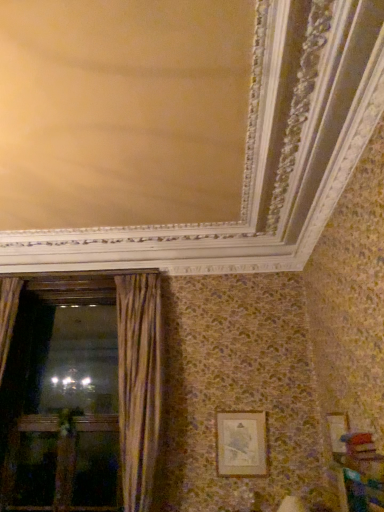
Question: Is gold textured curtain at left at the right side of wooden cabinet at lower right?

Choices:
 (A) no
 (B) yes

Answer: (A)

Question: Does gold textured curtain at left have a greater width compared to wooden cabinet at lower right?

Choices:
 (A) yes
 (B) no

Answer: (A)

Question: Is gold textured curtain at left facing towards wooden cabinet at lower right?

Choices:
 (A) no
 (B) yes

Answer: (A)

Question: From the image's perspective, is gold textured curtain at left over wooden cabinet at lower right?

Choices:
 (A) yes
 (B) no

Answer: (A)

Question: From a real-world perspective, is gold textured curtain at left located beneath wooden cabinet at lower right?

Choices:
 (A) yes
 (B) no

Answer: (B)

Question: Considering the positions of wooden cabinet at lower right and wooden screen door at left in the image, is wooden cabinet at lower right taller or shorter than wooden screen door at left?

Choices:
 (A) tall
 (B) short

Answer: (B)

Question: Relative to wooden screen door at left, is wooden cabinet at lower right in front or behind?

Choices:
 (A) behind
 (B) front

Answer: (B)

Question: From a real-world perspective, relative to wooden screen door at left, is wooden cabinet at lower right vertically above or below?

Choices:
 (A) below
 (B) above

Answer: (B)

Question: Does point (374, 489) appear closer or farther from the camera than point (41, 505)?

Choices:
 (A) closer
 (B) farther

Answer: (A)

Question: In terms of size, does wooden screen door at left appear bigger or smaller than gold textured frame at lower right?

Choices:
 (A) small
 (B) big

Answer: (B)

Question: Is wooden screen door at left taller or shorter than gold textured frame at lower right?

Choices:
 (A) short
 (B) tall

Answer: (B)

Question: In the image, is wooden screen door at left positioned in front of or behind gold textured frame at lower right?

Choices:
 (A) behind
 (B) front

Answer: (A)

Question: Is point (64, 476) positioned closer to the camera than point (261, 439)?

Choices:
 (A) farther
 (B) closer

Answer: (A)

Question: Is point (337, 457) positioned closer to the camera than point (228, 468)?

Choices:
 (A) closer
 (B) farther

Answer: (A)

Question: Based on their positions, is wooden cabinet at lower right located to the left or right of gold textured frame at lower right?

Choices:
 (A) left
 (B) right

Answer: (B)